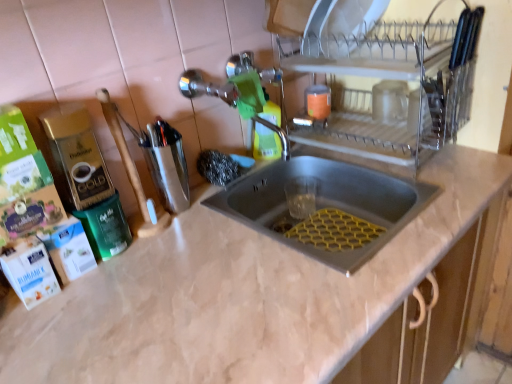
The image size is (512, 384). I want to click on free space in front of clear glass dish rack at upper right, the first appliance viewed from the right, so click(x=407, y=220).